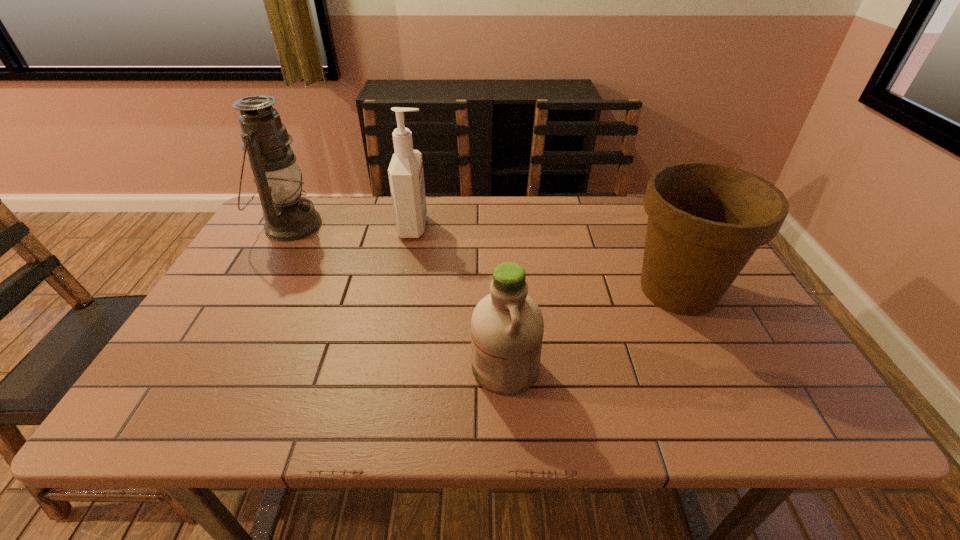
The image size is (960, 540). Find the location of `free spot at the near edge of the desktop`. free spot at the near edge of the desktop is located at coordinates (626, 416).

Find the location of `vacant area at the left edge of the desktop`. vacant area at the left edge of the desktop is located at coordinates (289, 275).

Locate an element on the screen. The height and width of the screenshot is (540, 960). free space between the second nearest object and the oil lamp is located at coordinates (485, 258).

Identify the location of free space between the third object from right to left and the rightmost object. (546, 258).

Where is `free space between the rightmost object and the leftmost object`? This screenshot has width=960, height=540. free space between the rightmost object and the leftmost object is located at coordinates (485, 258).

Where is `vacant region between the nearest object and the farther cleansing agent`? vacant region between the nearest object and the farther cleansing agent is located at coordinates (460, 297).

Locate an element on the screen. The image size is (960, 540). vacant area between the oil lamp and the taller cleansing agent is located at coordinates (352, 226).

Identify the location of free space between the leftmost object and the nearer cleansing agent. [397, 296].

Locate an element on the screen. The height and width of the screenshot is (540, 960). free space between the flowerpot and the second object from left to right is located at coordinates (546, 258).

Identify the location of free space between the leftmost object and the taller cleansing agent. coord(352,226).